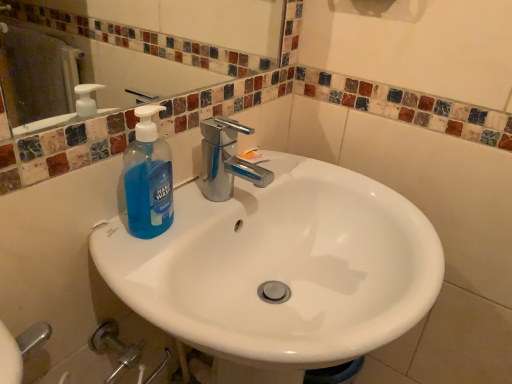
Question: Considering the relative sizes of blue translucent hand wash at upper left and white glossy sink at center in the image provided, is blue translucent hand wash at upper left bigger than white glossy sink at center?

Choices:
 (A) yes
 (B) no

Answer: (B)

Question: From a real-world perspective, is blue translucent hand wash at upper left positioned under white glossy sink at center based on gravity?

Choices:
 (A) yes
 (B) no

Answer: (B)

Question: Considering the relative positions of blue translucent hand wash at upper left and white glossy sink at center in the image provided, is blue translucent hand wash at upper left in front of white glossy sink at center?

Choices:
 (A) no
 (B) yes

Answer: (A)

Question: Is blue translucent hand wash at upper left to the left of white glossy sink at center from the viewer's perspective?

Choices:
 (A) yes
 (B) no

Answer: (A)

Question: From the image's perspective, is blue translucent hand wash at upper left located above white glossy sink at center?

Choices:
 (A) yes
 (B) no

Answer: (A)

Question: Would you say white glossy sink at center is part of blue translucent hand wash at upper left's contents?

Choices:
 (A) no
 (B) yes

Answer: (A)

Question: From a real-world perspective, is white glossy sink at center located beneath blue translucent hand wash at upper left?

Choices:
 (A) no
 (B) yes

Answer: (B)

Question: Can you confirm if white glossy sink at center is wider than blue translucent hand wash at upper left?

Choices:
 (A) no
 (B) yes

Answer: (B)

Question: From the image's perspective, is white glossy sink at center above blue translucent hand wash at upper left?

Choices:
 (A) yes
 (B) no

Answer: (B)

Question: Does white glossy sink at center contain blue translucent hand wash at upper left?

Choices:
 (A) no
 (B) yes

Answer: (B)

Question: Does white glossy sink at center have a greater height compared to blue translucent hand wash at upper left?

Choices:
 (A) yes
 (B) no

Answer: (A)

Question: From a real-world perspective, does white glossy sink at center stand above blue translucent hand wash at upper left?

Choices:
 (A) no
 (B) yes

Answer: (A)

Question: Considering the positions of blue translucent hand wash at upper left and white glossy sink at center in the image, is blue translucent hand wash at upper left wider or thinner than white glossy sink at center?

Choices:
 (A) wide
 (B) thin

Answer: (B)